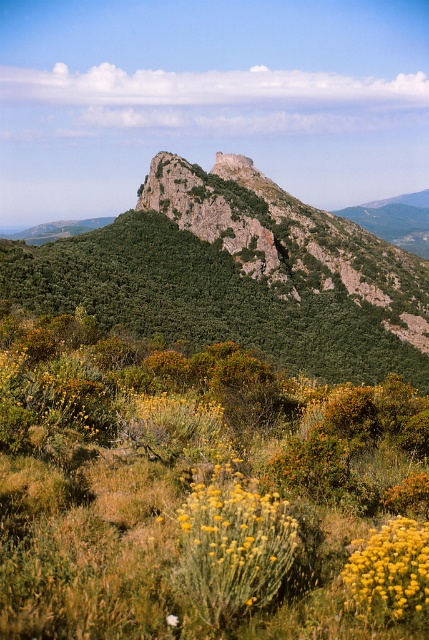
Between green rocky mountain at upper center and yellow fluffy bush at lower center, which one appears on the right side from the viewer's perspective?

From the viewer's perspective, green rocky mountain at upper center appears more on the right side.

Find the location of `green rocky mountain at upper center`. green rocky mountain at upper center is located at coordinates (238, 275).

Which is behind, point (265, 179) or point (359, 592)?

Point (265, 179)

The width and height of the screenshot is (429, 640). In order to click on green rocky mountain at upper center in this screenshot , I will do `click(238, 275)`.